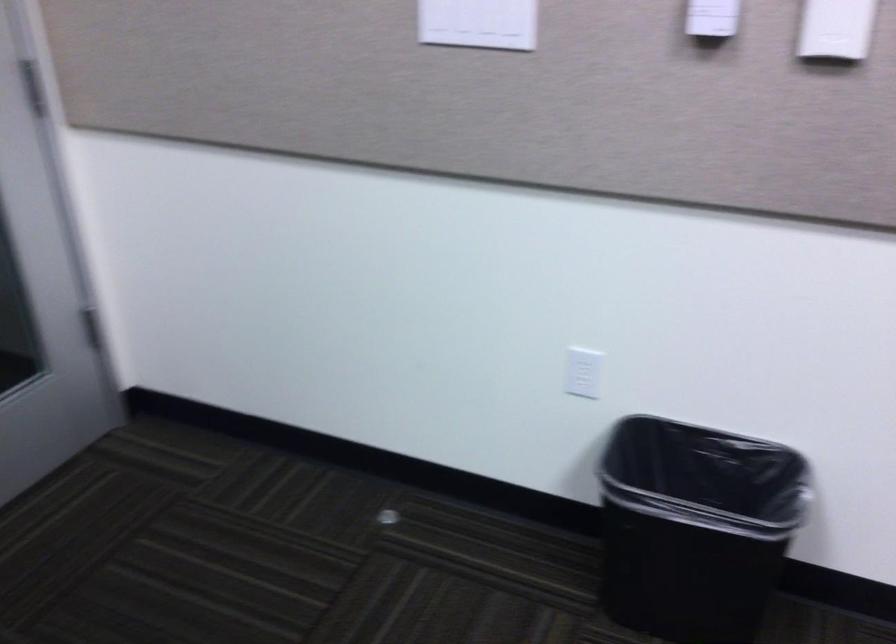
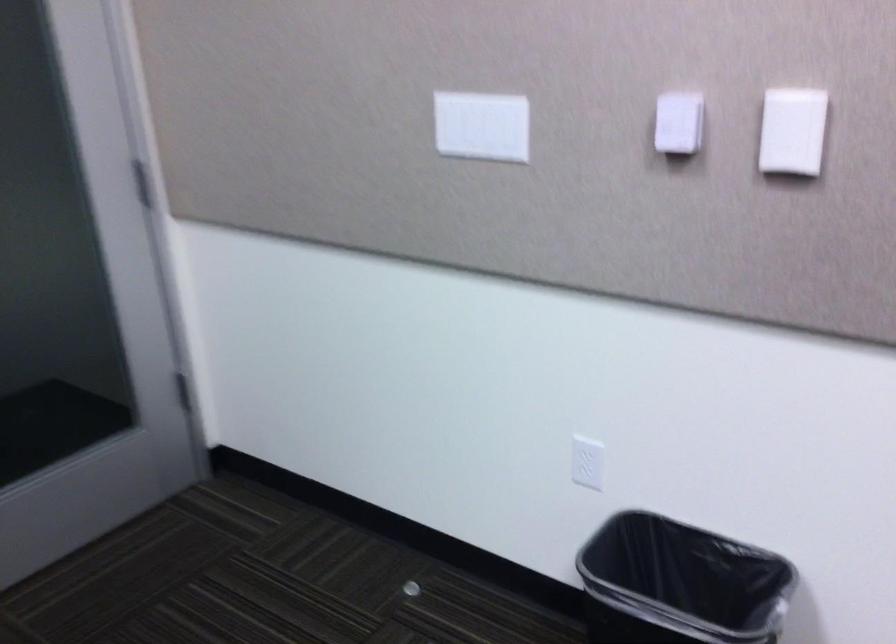
In the second image, find the point that corresponds to pixel 679 485 in the first image.

(679, 583)